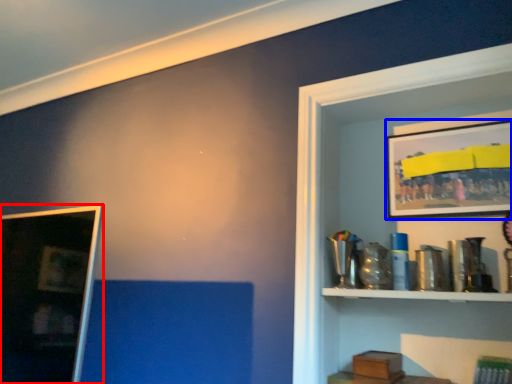
Question: Which point is closer to the camera, picture frame (highlighted by a red box) or picture frame (highlighted by a blue box)?

Choices:
 (A) picture frame
 (B) picture frame

Answer: (A)